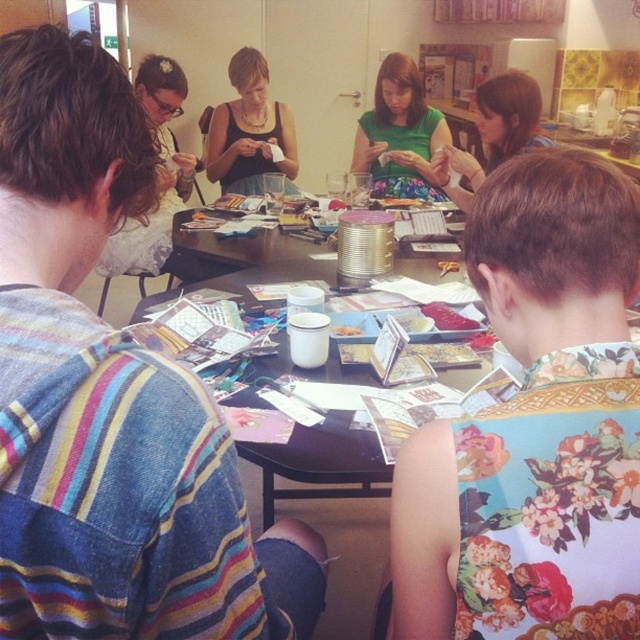
You are standing 1 meter away from the table. Can you reach the point at coordinate point [611,369] on the table without moving your feet?

The distance of point [611,369] is 61.55 centimeters from the viewer. Since you are standing 1 meter away, which is 100 centimeters, the point is closer to you than your current position. Therefore, you can reach it without moving your feet.

You are standing at the edge of the table and want to pick up both the matte black tank top at center and the white matte cup at center. Which item is farther from your current position?

The matte black tank top at center is farther from your current position as it is 2.18 meters away from the white matte cup at center.